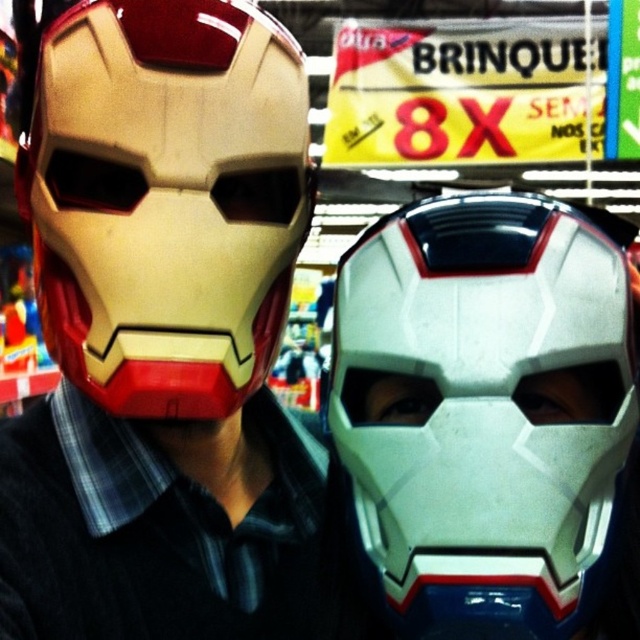
You are shopping in a store and see two items displayed on a shelf. The items are the matte gold helmet at center and the white matte mask at center. From your perspective, which item is positioned to the left?

The matte gold helmet at center is positioned to the left of the white matte mask at center.

You are a delivery person who needs to place a matte gold helmet at center into a box that is 20 inches in height. Can the helmet fit vertically in the box?

The matte gold helmet at center is 21.86 inches away from the camera, but this distance does not indicate its actual height. Therefore, we cannot determine if it will fit in the 20 inch tall box based on the given information.

You are a delivery person who needs to place a white matte helmet at center and a matte gold helmet at center into a box that can only hold items up to 6 inches apart. Based on the scene description, will the helmets fit in the box without exceeding the distance requirement?

The white matte helmet at center is 6.33 inches away from the matte gold helmet at center. Since the box can only hold items up to 6 inches apart, the helmets will not fit without exceeding the distance requirement.